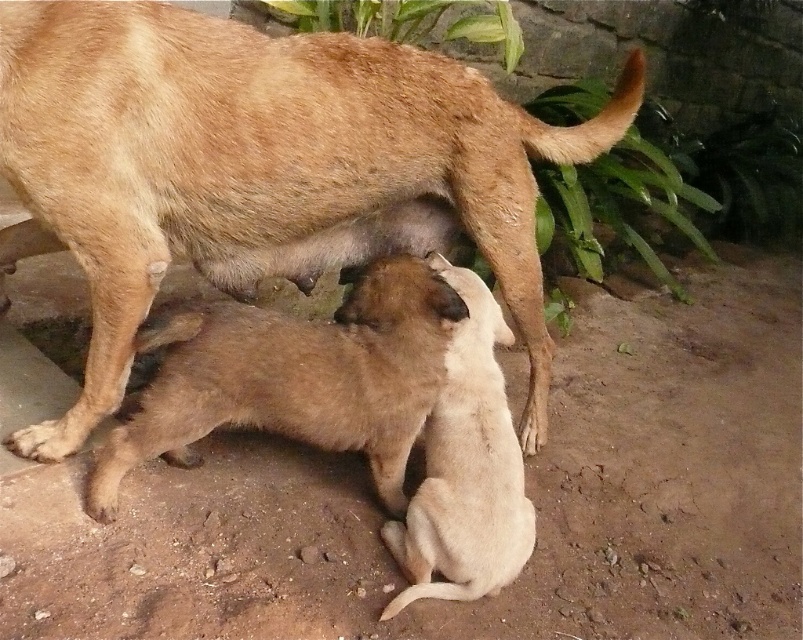
Question: Which object is positioned farthest from the brown furry pup at center?

Choices:
 (A) brown fur dog at center
 (B) light brown fur at center

Answer: (A)

Question: Does brown fur dog at center have a greater width compared to light brown fur at center?

Choices:
 (A) no
 (B) yes

Answer: (B)

Question: Which object appears farthest from the camera in this image?

Choices:
 (A) brown fur dog at center
 (B) brown furry pup at center

Answer: (B)

Question: Which object is the farthest from the brown furry pup at center?

Choices:
 (A) light brown fur at center
 (B) brown fur dog at center

Answer: (B)

Question: Can you confirm if brown fur dog at center is smaller than brown furry pup at center?

Choices:
 (A) yes
 (B) no

Answer: (B)

Question: Is brown fur dog at center closer to the viewer compared to light brown fur at center?

Choices:
 (A) no
 (B) yes

Answer: (B)